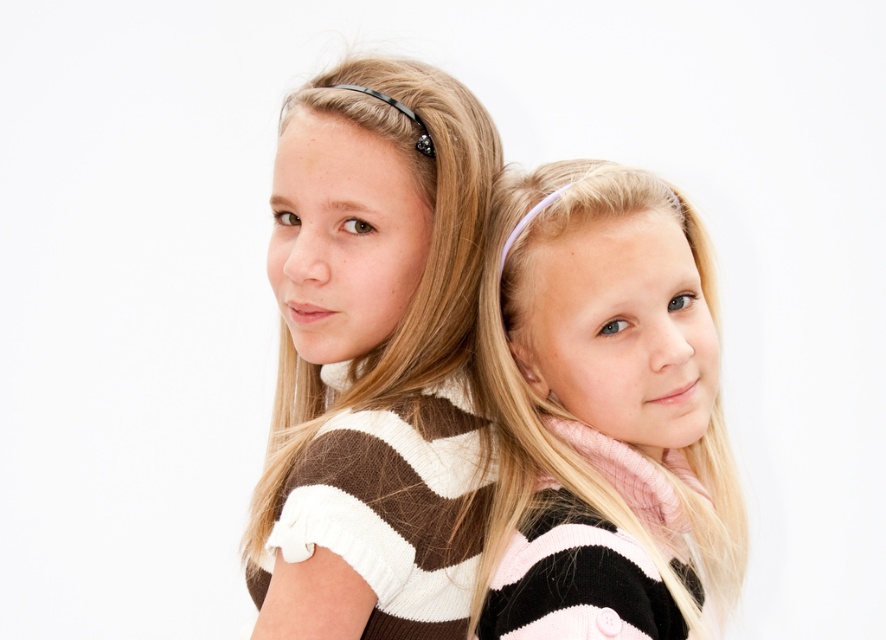
You are standing 30 inches away from the image. You want to touch the brown striped sweater at center. Can you reach it without moving closer?

The brown striped sweater at center is 25.69 inches away from the viewer. Since you are standing 30 inches away, you can reach it without moving closer.

You are a photographer trying to adjust the lighting for a photo shoot. You notice the brown striped sweater at center and the pink striped sweater at center. Which sweater is closer to the camera?

The brown striped sweater at center is closer to the camera because the pink striped sweater at center is behind it.

You are a photographer setting up a portrait for two girls wearing the brown striped sweater at center and the pink striped sweater at center. The backdrop is plain white. You need to ensure there is at least 5 inches of space between the two sweaters to avoid them looking cluttered. Based on the image, will the current spacing work?

The brown striped sweater at center and pink striped sweater at center are 4.02 inches apart from each other, which is less than the required 5 inches. Therefore, the current spacing is too close and may appear cluttered.